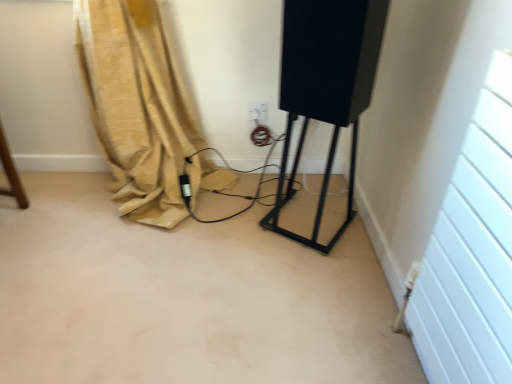
Question: From a real-world perspective, is black matte speaker at center below white plastic electric outlet at center?

Choices:
 (A) yes
 (B) no

Answer: (B)

Question: Is black matte speaker at center at the left side of white plastic electric outlet at center?

Choices:
 (A) no
 (B) yes

Answer: (A)

Question: Can you confirm if black matte speaker at center is shorter than white plastic electric outlet at center?

Choices:
 (A) yes
 (B) no

Answer: (B)

Question: Can we say black matte speaker at center lies outside white plastic electric outlet at center?

Choices:
 (A) no
 (B) yes

Answer: (B)

Question: Is black matte speaker at center to the right of white plastic electric outlet at center from the viewer's perspective?

Choices:
 (A) no
 (B) yes

Answer: (B)

Question: Is white plastic electric outlet at center to the left or to the right of black matte speaker at center in the image?

Choices:
 (A) left
 (B) right

Answer: (A)

Question: In the image, is white plastic electric outlet at center positioned in front of or behind black matte speaker at center?

Choices:
 (A) front
 (B) behind

Answer: (B)

Question: Based on their sizes in the image, would you say white plastic electric outlet at center is bigger or smaller than black matte speaker at center?

Choices:
 (A) small
 (B) big

Answer: (A)

Question: From a real-world perspective, is white plastic electric outlet at center positioned above or below black matte speaker at center?

Choices:
 (A) below
 (B) above

Answer: (A)

Question: Relative to beige fabric curtain at lower left, is white plastic electric outlet at center in front or behind?

Choices:
 (A) front
 (B) behind

Answer: (B)

Question: Is point (256, 102) positioned closer to the camera than point (143, 21)?

Choices:
 (A) farther
 (B) closer

Answer: (A)

Question: In terms of width, does white plastic electric outlet at center look wider or thinner when compared to beige fabric curtain at lower left?

Choices:
 (A) thin
 (B) wide

Answer: (A)

Question: Is white plastic electric outlet at center to the left or to the right of beige fabric curtain at lower left in the image?

Choices:
 (A) left
 (B) right

Answer: (B)

Question: Is beige fabric curtain at lower left spatially inside white plastic electric outlet at center, or outside of it?

Choices:
 (A) inside
 (B) outside

Answer: (B)

Question: Is point coord(121,87) positioned closer to the camera than point coord(263,119)?

Choices:
 (A) closer
 (B) farther

Answer: (A)